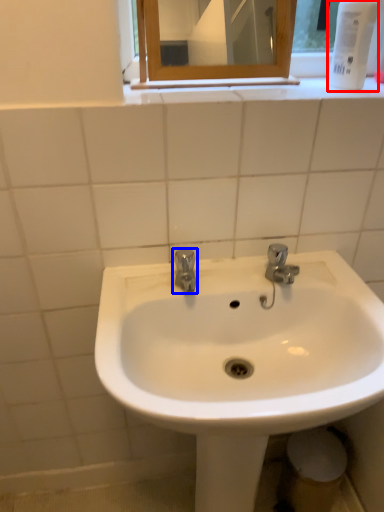
Question: Which object appears closest to the camera in this image, mouthwash (highlighted by a red box) or tap (highlighted by a blue box)?

Choices:
 (A) mouthwash
 (B) tap

Answer: (A)